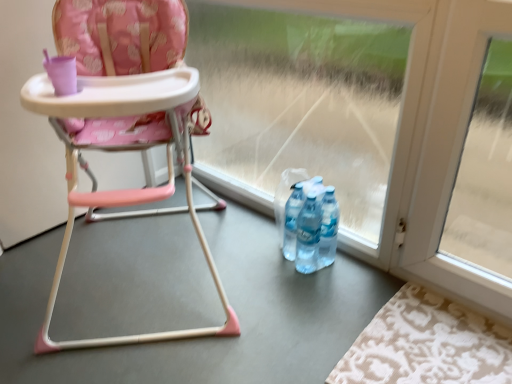
Question: Can you confirm if matte plastic highchair at center is shorter than beige damask rug at lower right?

Choices:
 (A) yes
 (B) no

Answer: (B)

Question: Does matte plastic highchair at center have a larger size compared to beige damask rug at lower right?

Choices:
 (A) yes
 (B) no

Answer: (A)

Question: Considering the relative sizes of matte plastic highchair at center and beige damask rug at lower right in the image provided, is matte plastic highchair at center smaller than beige damask rug at lower right?

Choices:
 (A) no
 (B) yes

Answer: (A)

Question: Is matte plastic highchair at center placed right next to beige damask rug at lower right?

Choices:
 (A) no
 (B) yes

Answer: (A)

Question: From the image's perspective, is matte plastic highchair at center under beige damask rug at lower right?

Choices:
 (A) yes
 (B) no

Answer: (B)

Question: Is matte plastic highchair at center positioned in front of beige damask rug at lower right?

Choices:
 (A) no
 (B) yes

Answer: (B)

Question: Considering the relative sizes of transparent glass door at center and matte plastic highchair at center in the image provided, is transparent glass door at center bigger than matte plastic highchair at center?

Choices:
 (A) no
 (B) yes

Answer: (A)

Question: Does transparent glass door at center have a smaller size compared to matte plastic highchair at center?

Choices:
 (A) yes
 (B) no

Answer: (A)

Question: Is transparent glass door at center closer to the viewer compared to matte plastic highchair at center?

Choices:
 (A) yes
 (B) no

Answer: (B)

Question: From the image's perspective, is transparent glass door at center on top of matte plastic highchair at center?

Choices:
 (A) yes
 (B) no

Answer: (A)

Question: Does transparent glass door at center have a greater width compared to matte plastic highchair at center?

Choices:
 (A) no
 (B) yes

Answer: (A)

Question: From a real-world perspective, is transparent glass door at center positioned under matte plastic highchair at center based on gravity?

Choices:
 (A) yes
 (B) no

Answer: (A)

Question: From the image's perspective, does beige damask rug at lower right appear higher than transparent glass door at center?

Choices:
 (A) no
 (B) yes

Answer: (A)